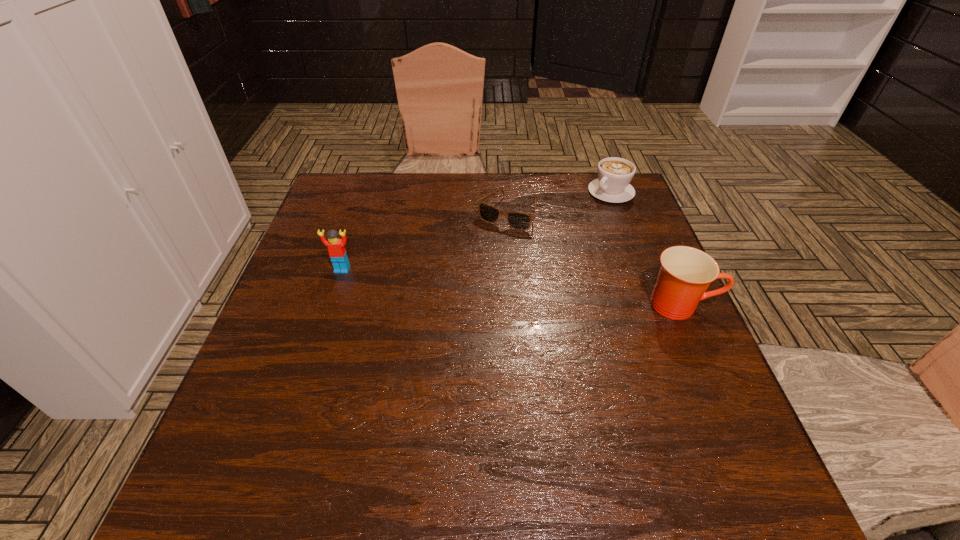
The image size is (960, 540). Identify the location of vacant space located 0.290m on the frames of the third object from right to left. (448, 302).

Find the location of a particular element. The image size is (960, 540). free space located 0.350m to the right of the cappuccino's handle is located at coordinates (528, 261).

Locate an element on the screen. free space located to the right of the cappuccino's handle is located at coordinates (590, 209).

At what (x,y) coordinates should I click in order to perform the action: click on vacant space located 0.320m to the right of the cappuccino's handle. Please return your answer as a coordinate pair (x, y). This screenshot has width=960, height=540. Looking at the image, I should click on (535, 255).

Identify the location of sunglasses that is at the far edge. The height and width of the screenshot is (540, 960). (521, 221).

This screenshot has width=960, height=540. What are the coordinates of `cappuccino that is at the far edge` in the screenshot? It's located at (614, 174).

At what (x,y) coordinates should I click in order to perform the action: click on object at the left edge. Please return your answer as a coordinate pair (x, y). Image resolution: width=960 pixels, height=540 pixels. Looking at the image, I should click on (336, 247).

Identify the location of cup present at the right edge. pos(686,272).

What are the coordinates of `cappuccino at the right edge` in the screenshot? It's located at (614, 174).

I want to click on object that is at the far right corner, so click(x=614, y=174).